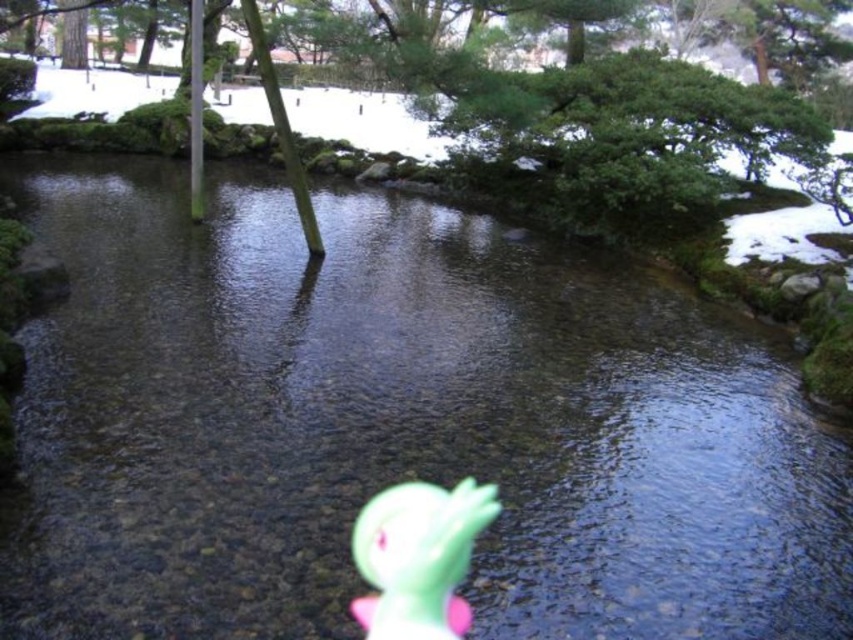
You are standing at the edge of the stream and see the green rubber duck at lower center and the green leafy tree at center. Which object would appear larger to you?

The green rubber duck at lower center is closer to the viewer than the green leafy tree at center, so it would appear larger.

You are standing at the edge of the stream and see two points in the scene. The first point is at coordinates point [405,506] and the second is at point [283,141]. Which point is nearer to you?

Point [405,506] is closer to the viewer than point [283,141].